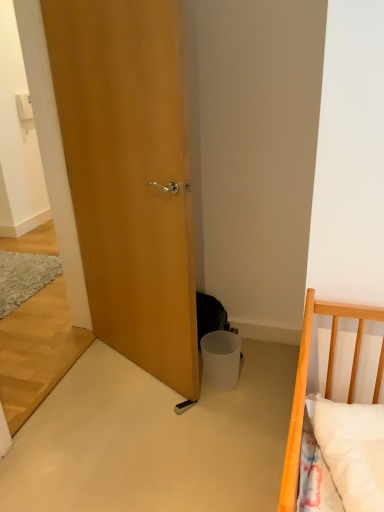
The height and width of the screenshot is (512, 384). I want to click on vacant space to the left of wooden door at center, so click(x=92, y=376).